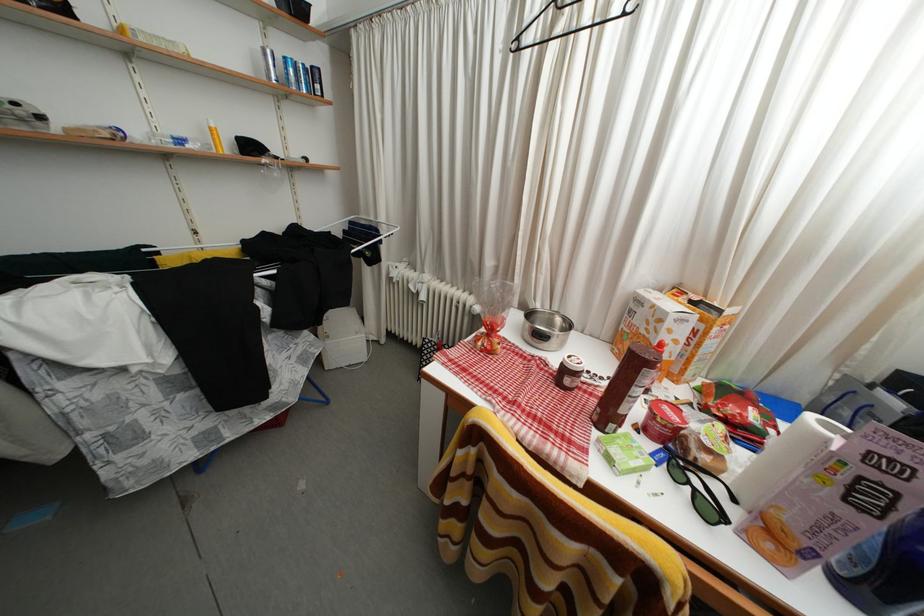
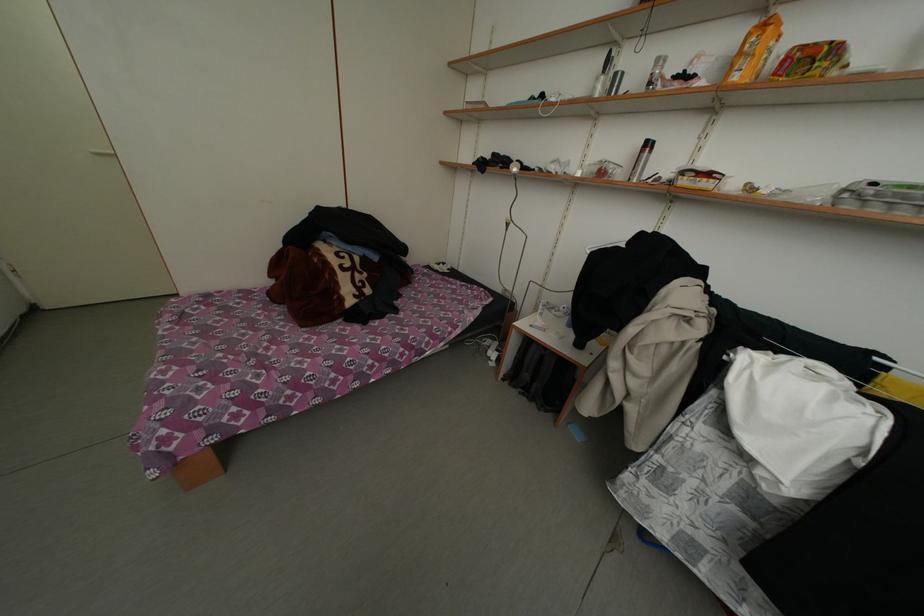
Looking at this image, the images are taken continuously from a first-person perspective. In which direction is your viewpoint rotating?

The camera's rotation is toward left-down.